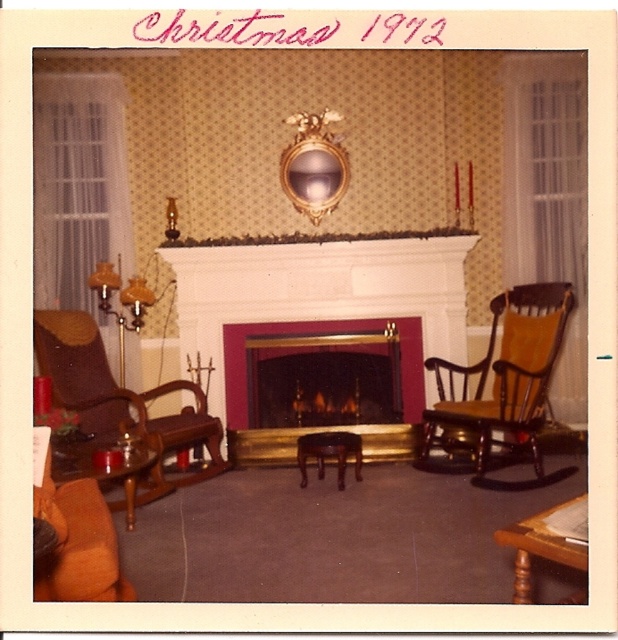
Is white glossy fireplace at center to the left of wooden rocking chair at right from the viewer's perspective?

Yes, white glossy fireplace at center is to the left of wooden rocking chair at right.

The image size is (618, 640). In order to click on white glossy fireplace at center in this screenshot , I will do `click(318, 292)`.

Identify the location of white glossy fireplace at center. This screenshot has height=640, width=618. (318, 292).

Does brown leather rocking chair at left come in front of wooden coffee table at lower left?

No, it is behind wooden coffee table at lower left.

I want to click on brown leather rocking chair at left, so [119, 397].

Is gold metallic fireplace at center shorter than wooden rocking chair at right?

Indeed, gold metallic fireplace at center has a lesser height compared to wooden rocking chair at right.

Describe the element at coordinates (323, 387) in the screenshot. The width and height of the screenshot is (618, 640). I see `gold metallic fireplace at center` at that location.

At what (x,y) coordinates should I click in order to perform the action: click on gold metallic fireplace at center. Please return your answer as a coordinate pair (x, y). This screenshot has height=640, width=618. Looking at the image, I should click on (323, 387).